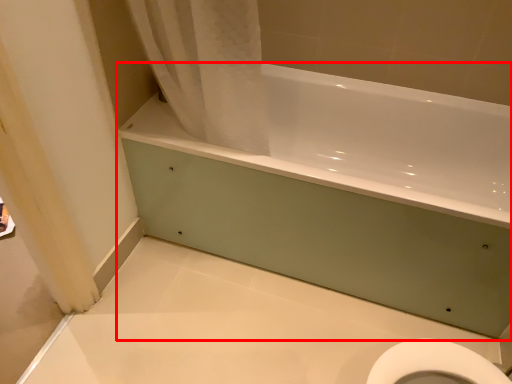
Question: From the image's perspective, considering the relative positions of bathtub (annotated by the red box) and shower curtain in the image provided, where is bathtub (annotated by the red box) located with respect to the staircase?

Choices:
 (A) below
 (B) above

Answer: (A)